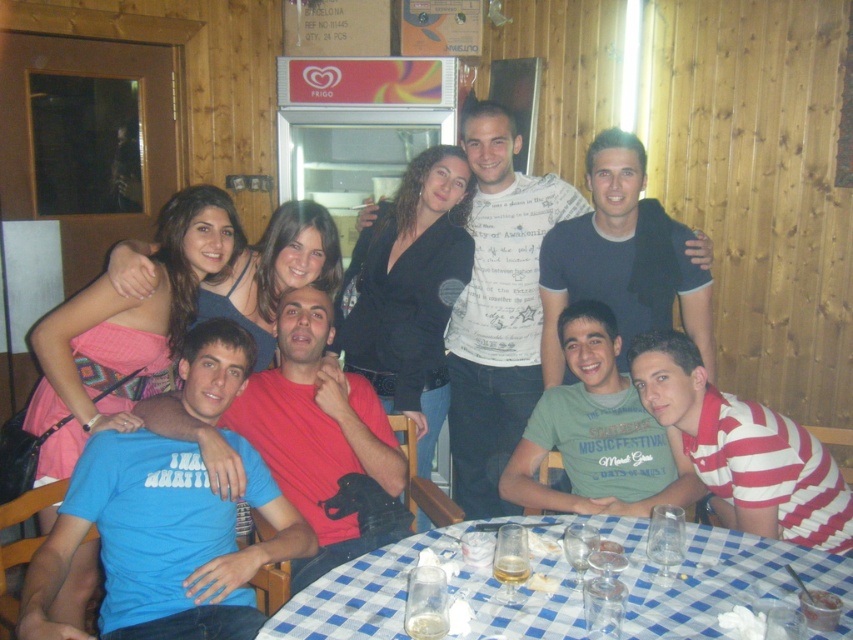
The height and width of the screenshot is (640, 853). Describe the element at coordinates (497, 240) in the screenshot. I see `white printed t-shirt at center` at that location.

Can you confirm if white printed t-shirt at center is smaller than white striped shirt at lower right?

No.

Locate an element on the screen. white printed t-shirt at center is located at coordinates (497, 240).

Is green cotton shirt at lower center to the left of dark blue t-shirt at center from the viewer's perspective?

Indeed, green cotton shirt at lower center is positioned on the left side of dark blue t-shirt at center.

The image size is (853, 640). Describe the element at coordinates (598, 433) in the screenshot. I see `green cotton shirt at lower center` at that location.

This screenshot has height=640, width=853. I want to click on green cotton shirt at lower center, so click(598, 433).

This screenshot has width=853, height=640. What do you see at coordinates (743, 449) in the screenshot?
I see `white striped shirt at lower right` at bounding box center [743, 449].

You are a GUI agent. You are given a task and a screenshot of the screen. Output one action in this format:
    pyautogui.click(x=<x>, y=<y>)
    Task: Click on the white striped shirt at lower right
    
    Given the screenshot: What is the action you would take?
    pyautogui.click(x=743, y=449)

Where is `white striped shirt at lower right`? white striped shirt at lower right is located at coordinates (743, 449).